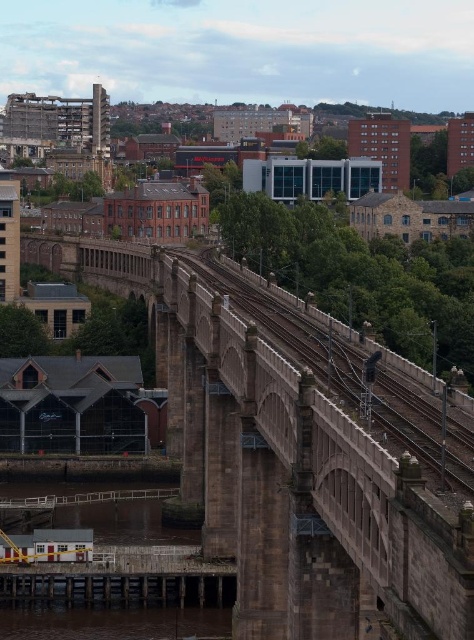
Question: Is brown stone bridge at center smaller than brown stone train track at center?

Choices:
 (A) no
 (B) yes

Answer: (A)

Question: Can you confirm if brown stone bridge at center is positioned below brown stone train track at center?

Choices:
 (A) yes
 (B) no

Answer: (A)

Question: Which point is closer to the camera taking this photo?

Choices:
 (A) (67, 259)
 (B) (379, 428)

Answer: (B)

Question: Which object is closer to the camera taking this photo?

Choices:
 (A) brown stone train track at center
 (B) brown stone bridge at center

Answer: (B)

Question: Is brown stone bridge at center above brown stone train track at center?

Choices:
 (A) yes
 (B) no

Answer: (B)